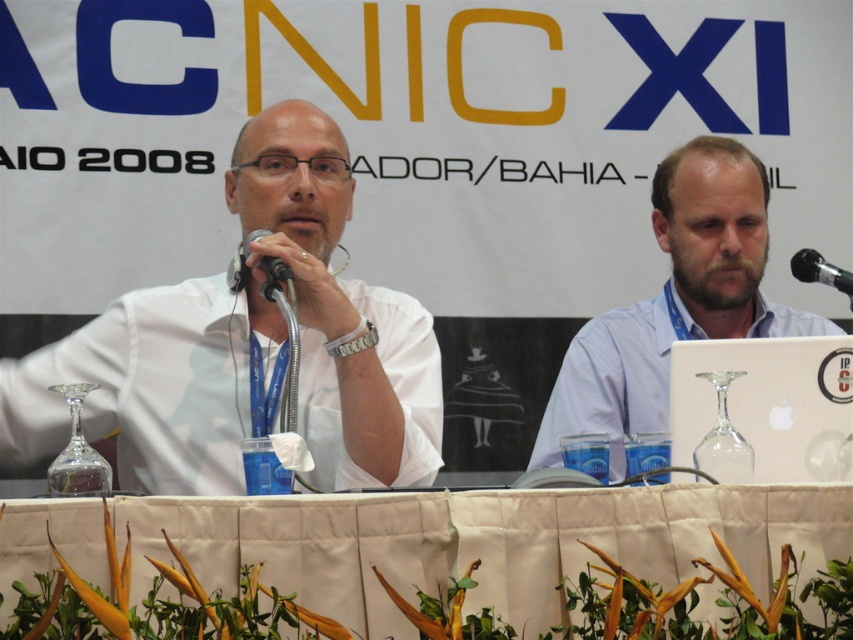
You are attending a conference and need to place a name tag on the table. The name tag is 10 cm wide. Can you fit it on the white fabric table at center without overlapping the white matte shirt at left?

The white fabric table at center is to the right of the white matte shirt at left, so there is enough space to place the 10 cm wide name tag on the table without overlapping the shirt.

You are a photographer standing at the camera position. You want to focus on the point that is closer to you. Which point should you choose between point [108,627] and point [804,260]?

Point [108,627] is closer to the camera than point [804,260], so you should choose point [108,627] to focus on.